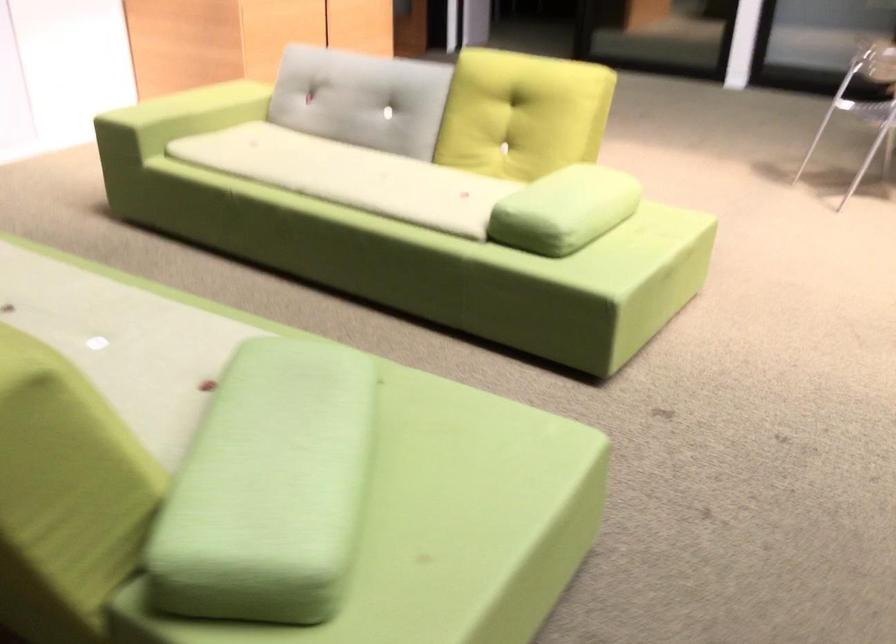
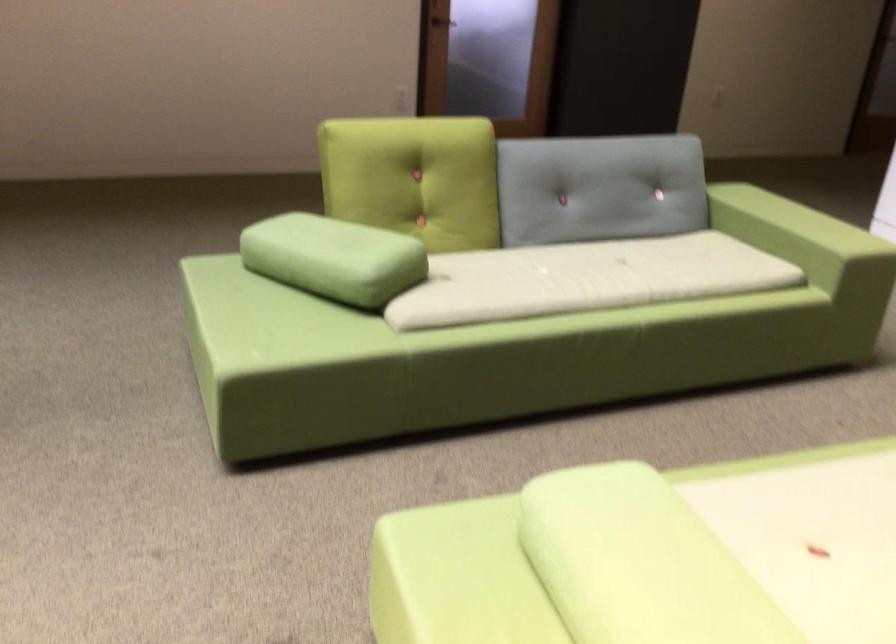
Find the pixel in the second image that matches the point at 362,389 in the first image.

(333, 258)